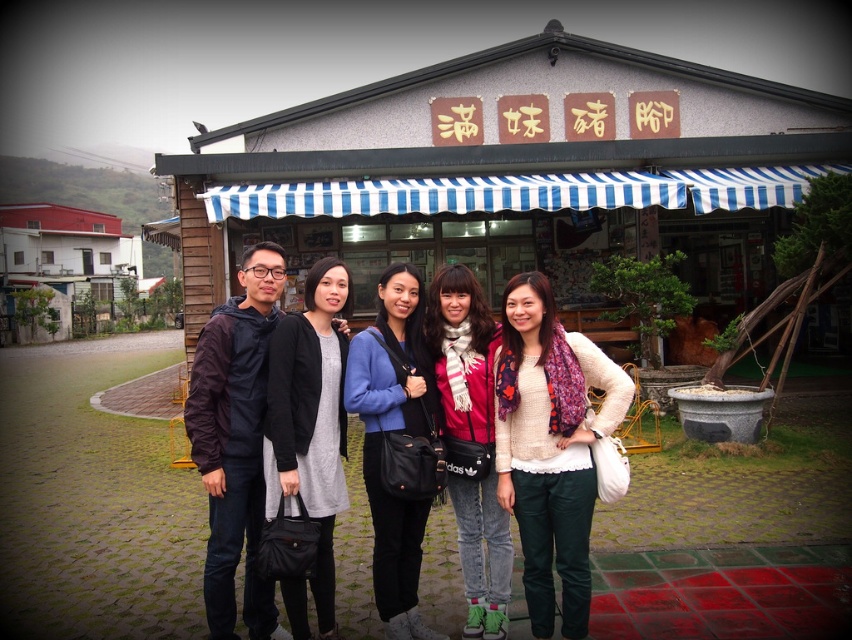
Question: Which of the following is the farthest from the observer?

Choices:
 (A) (586, 563)
 (B) (447, 436)
 (C) (413, 362)

Answer: (C)

Question: Which of the following is the farthest from the observer?

Choices:
 (A) matte black bag at center
 (B) white knitted sweater at center
 (C) red scarf at center
 (D) matte gray dress at center

Answer: (C)

Question: Can you confirm if white knitted sweater at center is positioned to the right of matte gray dress at center?

Choices:
 (A) no
 (B) yes

Answer: (B)

Question: Which point is closer to the camera?

Choices:
 (A) red scarf at center
 (B) matte gray dress at center
 (C) white knitted sweater at center

Answer: (B)

Question: Is white knitted sweater at center below matte black bag at center?

Choices:
 (A) yes
 (B) no

Answer: (B)

Question: Is white knitted sweater at center above matte gray dress at center?

Choices:
 (A) yes
 (B) no

Answer: (B)